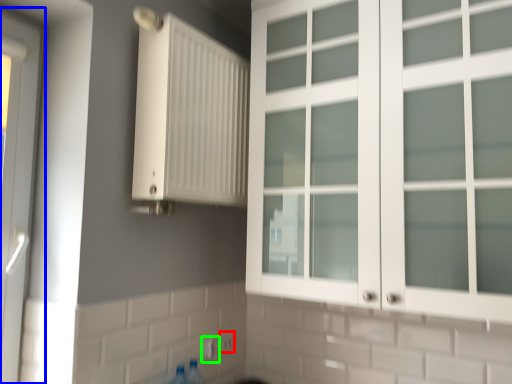
Question: Which is nearer to the electric outlet (highlighted by a red box)? door (highlighted by a blue box) or electric outlet (highlighted by a green box).

Choices:
 (A) door
 (B) electric outlet

Answer: (B)